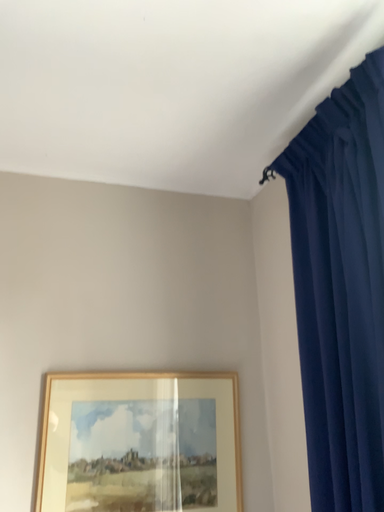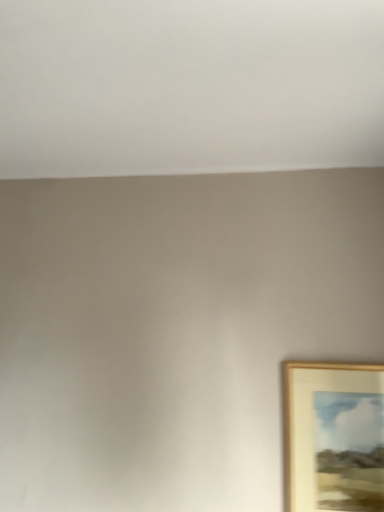
Question: How did the camera likely rotate when shooting the video?

Choices:
 (A) rotated left
 (B) rotated right

Answer: (A)